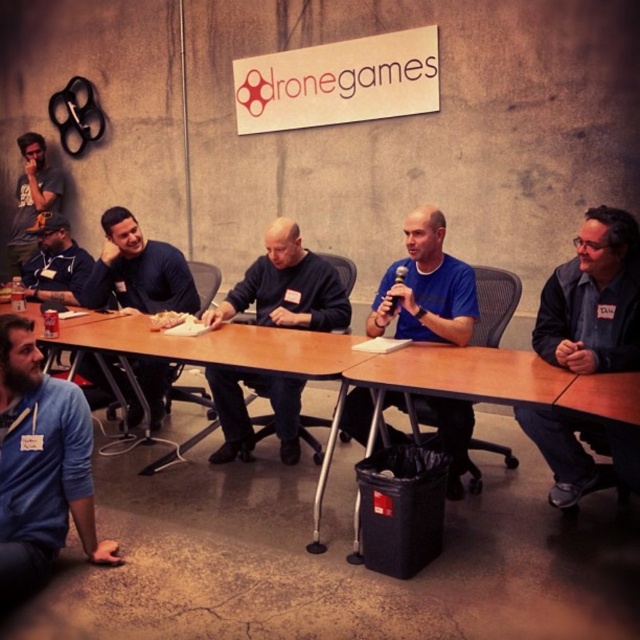
Question: Among these objects, which one is farthest from the camera?

Choices:
 (A) matte black shirt at lower left
 (B) matte black shirt at upper left
 (C) dark blue sweater at center
 (D) blue matte shirt at center

Answer: (B)

Question: Which point appears closest to the camera in this image?

Choices:
 (A) (68, 483)
 (B) (109, 275)
 (C) (426, 292)

Answer: (A)

Question: Can you confirm if blue denim jacket at right is thinner than matte black shirt at lower left?

Choices:
 (A) yes
 (B) no

Answer: (A)

Question: Among these points, which one is farthest from the camera?

Choices:
 (A) (428, 209)
 (B) (557, 352)
 (C) (115, 243)
 (D) (58, 208)

Answer: (D)

Question: Is blue matte shirt at center wider than matte black shirt at upper left?

Choices:
 (A) no
 (B) yes

Answer: (A)

Question: Does blue denim jacket at right appear on the right side of matte blue sweater at left?

Choices:
 (A) no
 (B) yes

Answer: (B)